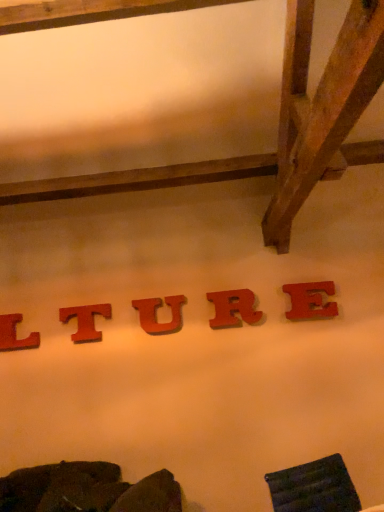
Question: Should I look upward or downward to see matte wood letter r at center, arranged as the 4th letter when viewed from the left?

Choices:
 (A) down
 (B) up

Answer: (A)

Question: Is matte wood letter r at center, arranged as the 4th letter when viewed from the left, surrounding matte wood letter t at center, which is counted as the 4th letter, starting from the right?

Choices:
 (A) no
 (B) yes

Answer: (A)

Question: Is matte wood letter r at center, arranged as the 4th letter when viewed from the left, wider than matte wood letter t at center, the second letter in the left-to-right sequence?

Choices:
 (A) no
 (B) yes

Answer: (A)

Question: Is matte wood letter r at center, which appears as the 2th letter when viewed from the right, not within matte wood letter t at center, which is counted as the 4th letter, starting from the right?

Choices:
 (A) no
 (B) yes

Answer: (B)

Question: From the image's perspective, does matte wood letter r at center, arranged as the 4th letter when viewed from the left, appear lower than matte wood letter t at center, which is counted as the 4th letter, starting from the right?

Choices:
 (A) no
 (B) yes

Answer: (A)

Question: Can you confirm if matte wood letter r at center, arranged as the 4th letter when viewed from the left, is taller than matte wood letter t at center, which is counted as the 4th letter, starting from the right?

Choices:
 (A) yes
 (B) no

Answer: (A)

Question: Is matte wood letter r at center, arranged as the 4th letter when viewed from the left, positioned far away from matte wood letter t at center, which is counted as the 4th letter, starting from the right?

Choices:
 (A) no
 (B) yes

Answer: (A)

Question: Is red matte letter e at center, the fifth letter viewed from the left, closer to the viewer compared to matte wood letter r at center, arranged as the 4th letter when viewed from the left?

Choices:
 (A) no
 (B) yes

Answer: (B)

Question: Considering the relative sizes of red matte letter e at center, arranged as the first letter when viewed from the right, and matte wood letter r at center, which appears as the 2th letter when viewed from the right, in the image provided, is red matte letter e at center, arranged as the first letter when viewed from the right, smaller than matte wood letter r at center, which appears as the 2th letter when viewed from the right,?

Choices:
 (A) yes
 (B) no

Answer: (A)

Question: From the image's perspective, would you say red matte letter e at center, the fifth letter viewed from the left, is positioned over matte wood letter r at center, which appears as the 2th letter when viewed from the right?

Choices:
 (A) yes
 (B) no

Answer: (A)

Question: Is red matte letter e at center, the fifth letter viewed from the left, turned away from matte wood letter r at center, which appears as the 2th letter when viewed from the right?

Choices:
 (A) yes
 (B) no

Answer: (B)

Question: Is red matte letter e at center, the fifth letter viewed from the left, shorter than matte wood letter r at center, arranged as the 4th letter when viewed from the left?

Choices:
 (A) no
 (B) yes

Answer: (B)

Question: Is red matte letter e at center, the fifth letter viewed from the left, at the right side of matte wood letter r at center, which appears as the 2th letter when viewed from the right?

Choices:
 (A) yes
 (B) no

Answer: (A)

Question: Is red wood letter at lower left, arranged as the 5th letter when viewed from the right, aimed at matte wood letter u at center, the 3th letter from the right?

Choices:
 (A) yes
 (B) no

Answer: (B)